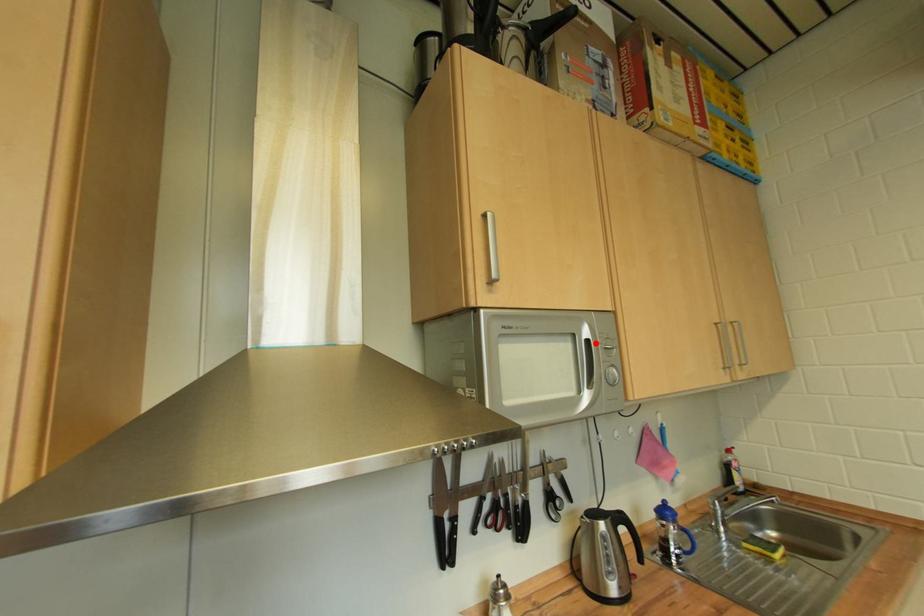
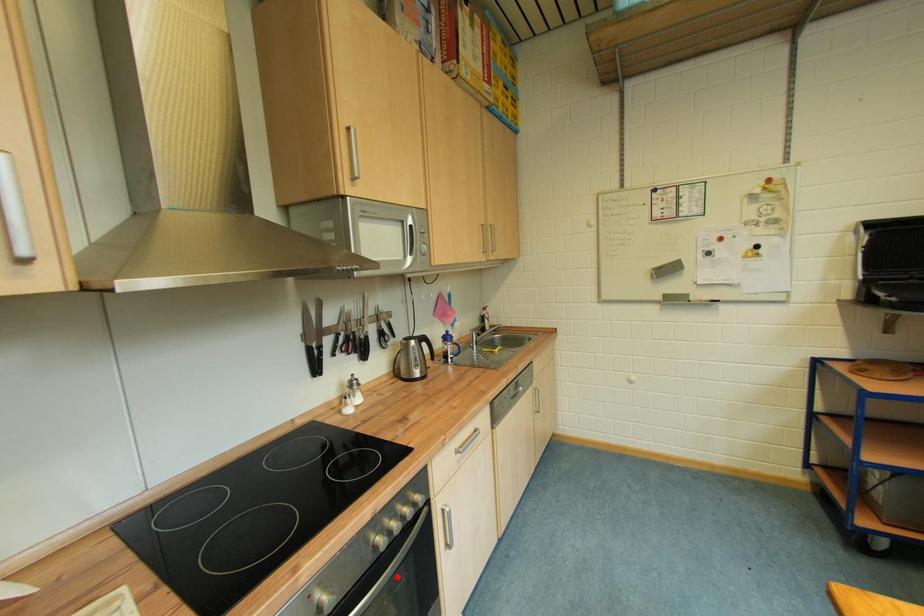
Based on the photo, I am providing you with two images of the same scene from different viewpoints. A red point is marked on the first image and another point is marked on the second image. Are the points marked in image1 and image2 representing the same 3D position?

No